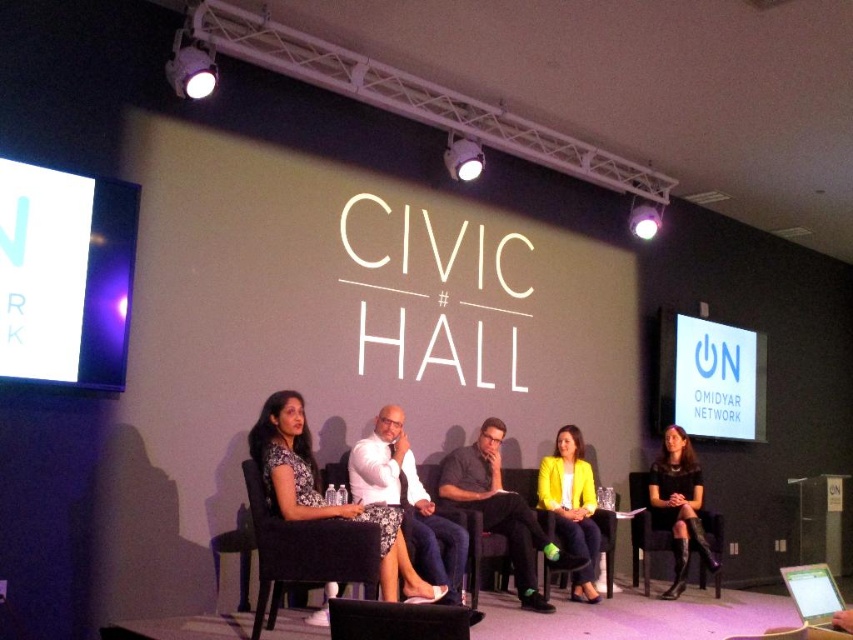
Question: Which object is closer to the camera taking this photo?

Choices:
 (A) black leather chair at lower right
 (B) black fabric chair at center

Answer: (B)

Question: Which of the following is the farthest from the observer?

Choices:
 (A) yellow matte jacket at center
 (B) matte black dress at center
 (C) dark brown leather chair at center

Answer: (A)

Question: Which point is farther from the camera taking this photo?

Choices:
 (A) (808, 580)
 (B) (450, 470)
 (C) (289, 512)

Answer: (B)

Question: In this image, where is yellow matte blazer at center located relative to silver metallic laptop at lower right?

Choices:
 (A) above
 (B) below

Answer: (B)

Question: Does matte black dress at center have a greater width compared to black fabric chair at center?

Choices:
 (A) yes
 (B) no

Answer: (A)

Question: Where is yellow matte jacket at center located in relation to silver metallic laptop at lower right in the image?

Choices:
 (A) right
 (B) left

Answer: (B)